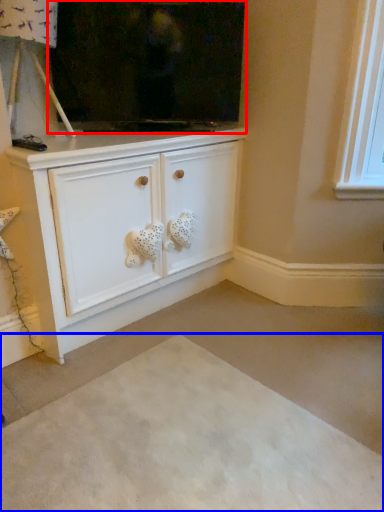
Question: Which object appears closest to the camera in this image, fireplace (highlighted by a red box) or plain (highlighted by a blue box)?

Choices:
 (A) fireplace
 (B) plain

Answer: (B)